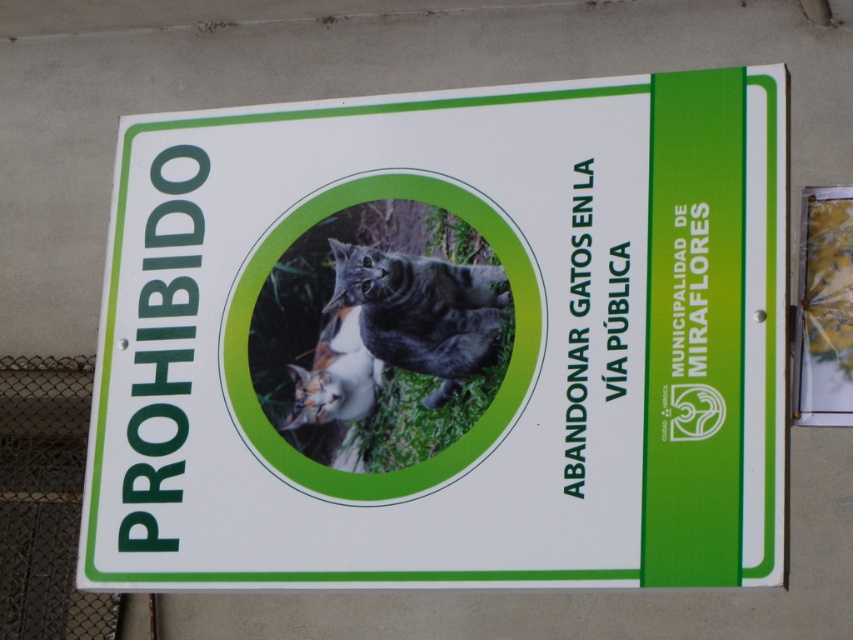
Is green plastic sign at center closer to the viewer compared to metal chain-link fence at lower left?

Yes.

Does green plastic sign at center come behind metal chain-link fence at lower left?

No.

Is point (772, 125) closer to viewer compared to point (39, 529)?

That is True.

Locate an element on the screen. This screenshot has height=640, width=853. green plastic sign at center is located at coordinates (450, 339).

Is gray tabby cat at center in front of calico fur cat at center?

Yes, it is.

Based on the photo, measure the distance between gray tabby cat at center and camera.

A distance of 4.03 meters exists between gray tabby cat at center and camera.

This screenshot has width=853, height=640. Identify the location of gray tabby cat at center. (421, 310).

Can you confirm if green plastic sign at center is shorter than green grass at center?

No, green plastic sign at center is not shorter than green grass at center.

Is green plastic sign at center positioned at the back of green grass at center?

No, green plastic sign at center is in front of green grass at center.

Image resolution: width=853 pixels, height=640 pixels. What do you see at coordinates (450, 339) in the screenshot? I see `green plastic sign at center` at bounding box center [450, 339].

The height and width of the screenshot is (640, 853). What are the coordinates of `green plastic sign at center` in the screenshot? It's located at (450, 339).